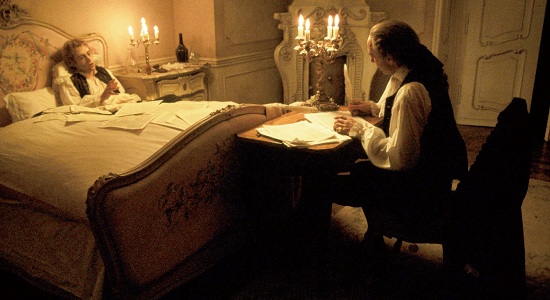
Locate an element on the screen. The width and height of the screenshot is (550, 300). candles is located at coordinates (335, 29), (332, 29), (299, 34), (308, 34), (157, 37), (148, 36), (143, 34), (133, 34).